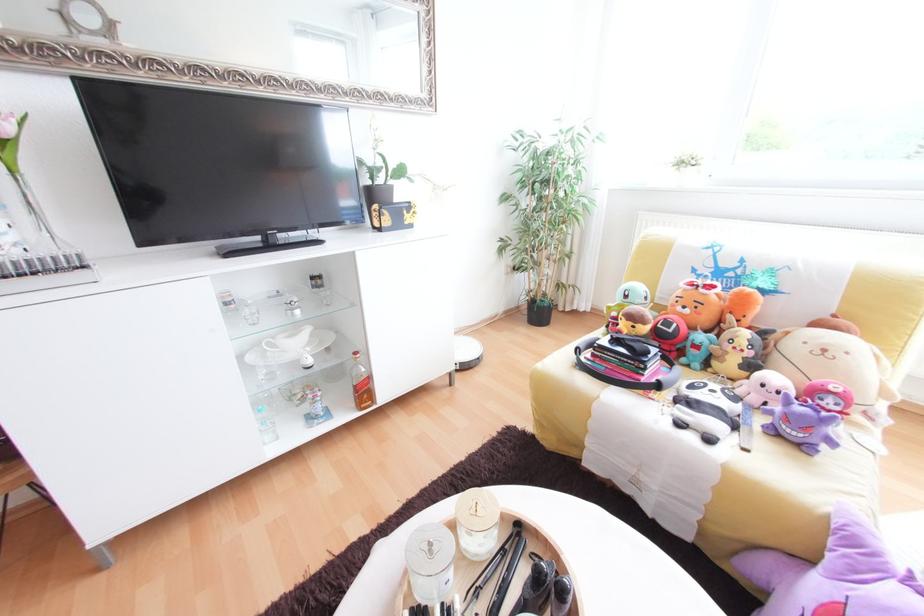
Find where to grasp the orange plush toy. Please return your answer as a coordinate pair (x, y).

(698, 304)